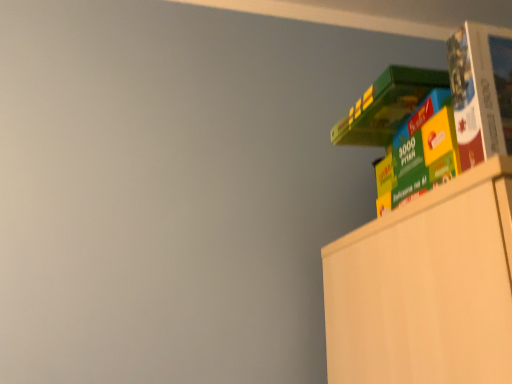
What do you see at coordinates (481, 91) in the screenshot?
I see `hardcover book at upper right` at bounding box center [481, 91].

Locate an element on the screen. This screenshot has height=384, width=512. hardcover book at upper right is located at coordinates (481, 91).

What is the approximate width of hardcover book at upper right?

It is 7.91 centimeters.

In order to face hardcover book at upper right, should I rotate leftwards or rightwards?

Rotate right and turn 36.073 degrees.

What is the approximate height of hardcover book at upper right?

The height of hardcover book at upper right is 9.63 inches.

Find the location of a particular element. hardcover book at upper right is located at coordinates (481, 91).